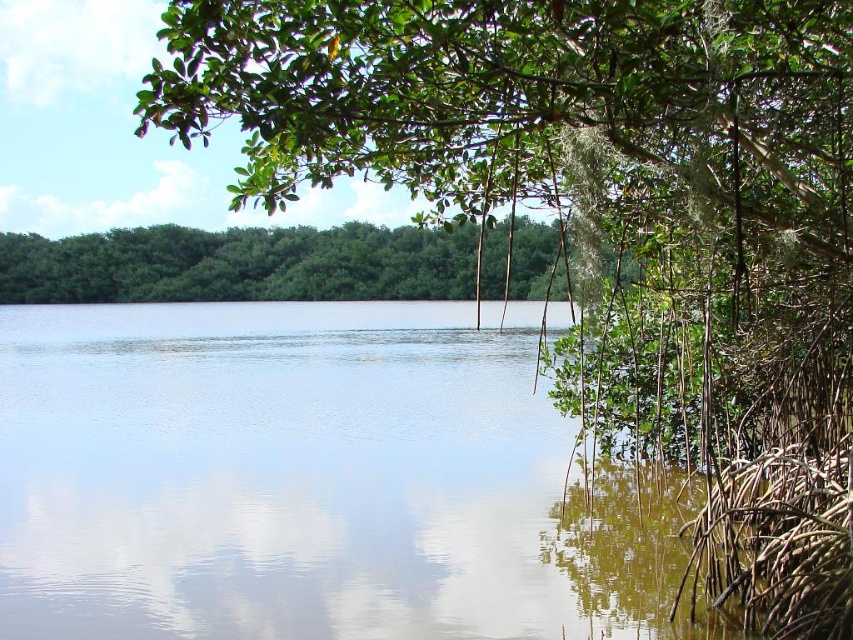
Question: Can you confirm if clear water at center is positioned below green leafy trees at center?

Choices:
 (A) yes
 (B) no

Answer: (A)

Question: Which of the following is the closest to the observer?

Choices:
 (A) clear water at center
 (B) green leafy trees at center

Answer: (B)

Question: Which point is closer to the camera taking this photo?

Choices:
 (A) (117, 525)
 (B) (445, 296)

Answer: (A)

Question: Is clear water at center wider than green leafy trees at center?

Choices:
 (A) yes
 (B) no

Answer: (A)

Question: Does clear water at center have a smaller size compared to green leafy trees at center?

Choices:
 (A) no
 (B) yes

Answer: (A)